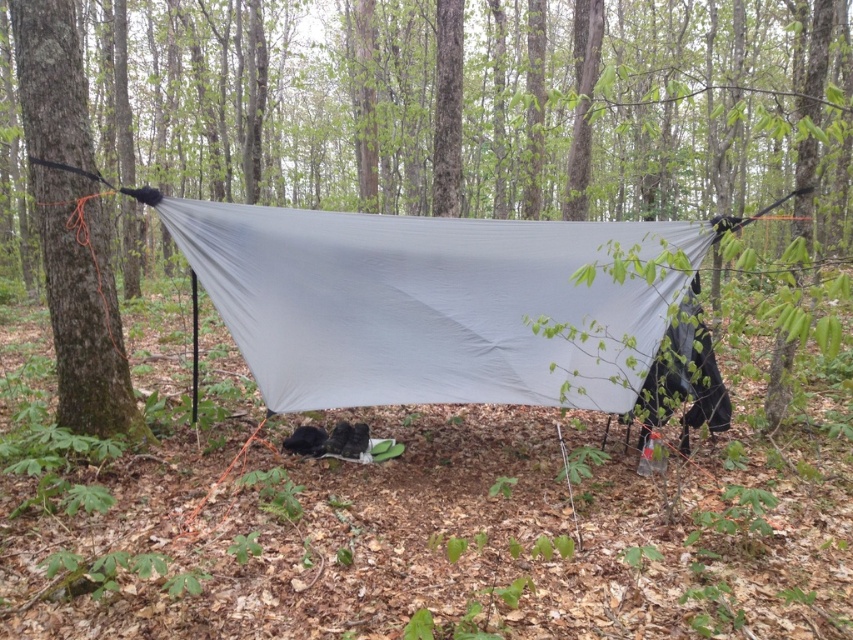
Is matte gray tarp at center closer to the viewer compared to smooth bark tree at left?

Yes, matte gray tarp at center is closer to the viewer.

Which is in front, point (469, 385) or point (57, 419)?

Point (469, 385) is in front.

Identify the location of matte gray tarp at center. The height and width of the screenshot is (640, 853). (451, 308).

Find the location of a particular element. Image resolution: width=853 pixels, height=640 pixels. matte gray tarp at center is located at coordinates (451, 308).

Who is shorter, green matte tarp at center or smooth bark tree at left?

smooth bark tree at left is shorter.

Based on the photo, does green matte tarp at center appear on the right side of smooth bark tree at left?

Yes, green matte tarp at center is to the right of smooth bark tree at left.

Which is in front, point (701, 186) or point (99, 371)?

Point (99, 371) is more forward.

Where is `green matte tarp at center`? Image resolution: width=853 pixels, height=640 pixels. green matte tarp at center is located at coordinates (480, 104).

Which is more to the right, green matte tarp at center or matte gray tarp at center?

Positioned to the right is matte gray tarp at center.

What do you see at coordinates (480, 104) in the screenshot? Image resolution: width=853 pixels, height=640 pixels. I see `green matte tarp at center` at bounding box center [480, 104].

Which is behind, point (693, 200) or point (247, 340)?

The point (693, 200) is more distant.

Where is `green matte tarp at center`? green matte tarp at center is located at coordinates (480, 104).